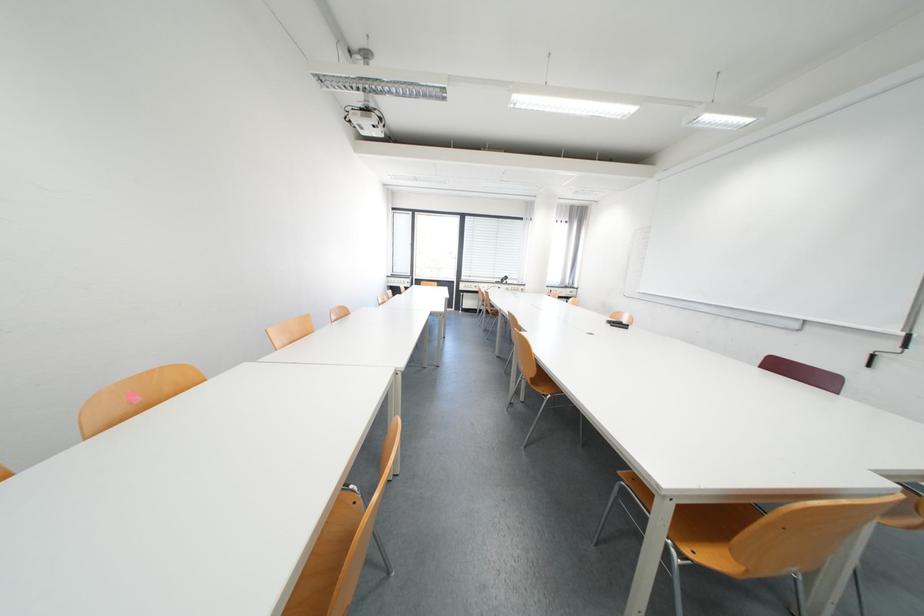
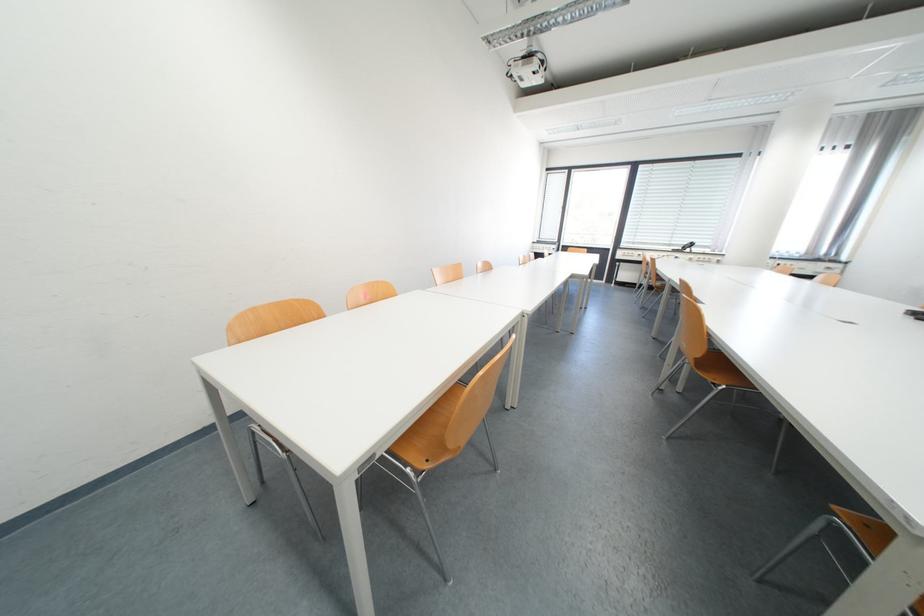
Question: How did the camera likely rotate?

Choices:
 (A) Left
 (B) Right
 (C) Up
 (D) Down

Answer: (A)